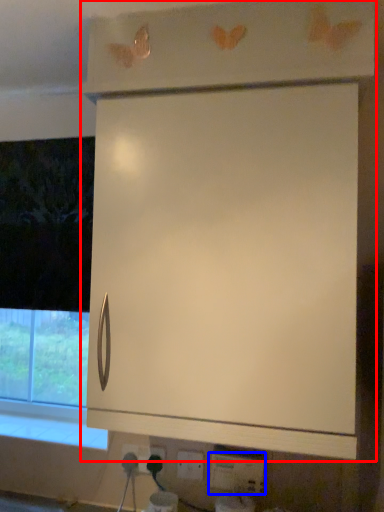
Question: Which object appears farthest to the camera in this image, cabinetry (highlighted by a red box) or electric outlet (highlighted by a blue box)?

Choices:
 (A) cabinetry
 (B) electric outlet

Answer: (B)